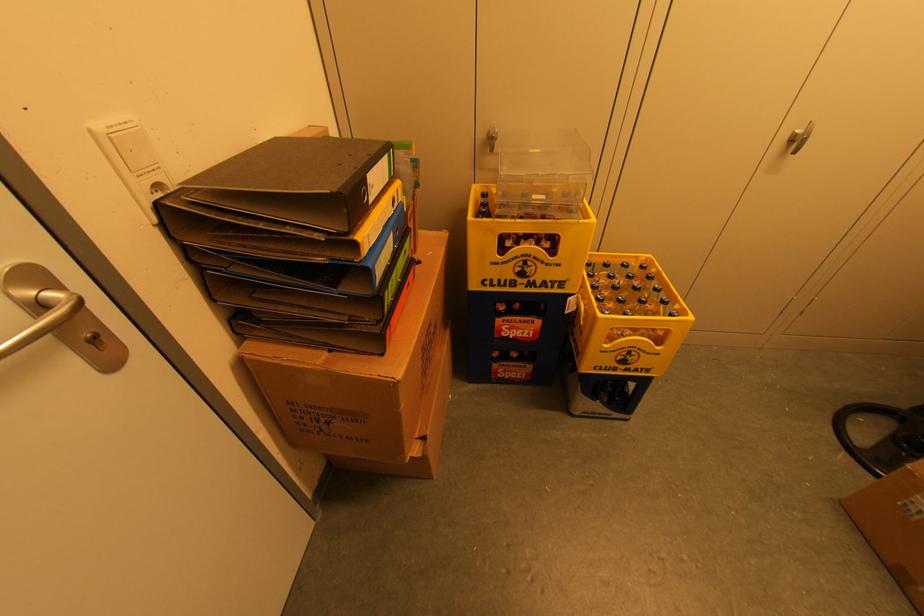
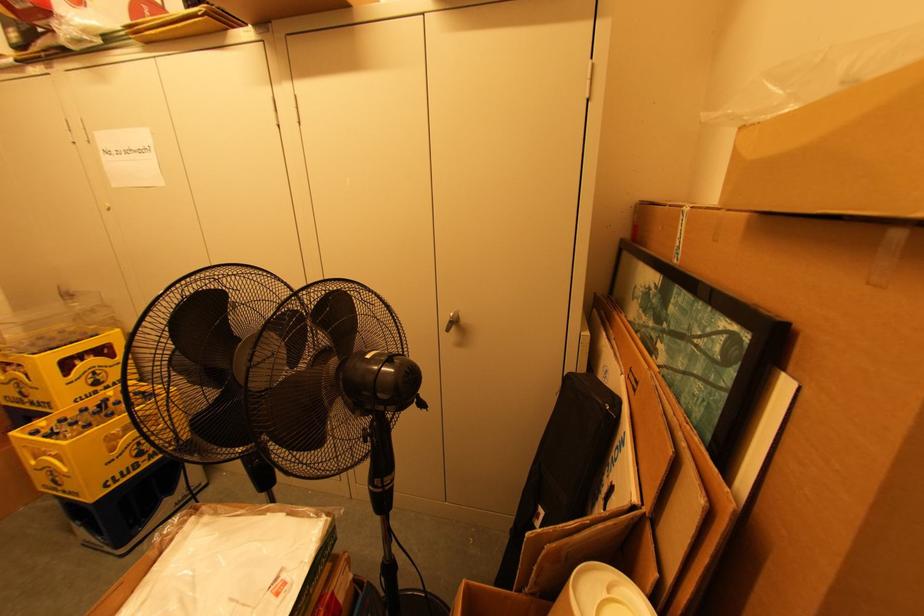
Question: The images are taken continuously from a first-person perspective. In which direction are you moving?

Choices:
 (A) Left
 (B) Right
 (C) Forward
 (D) Backward

Answer: (B)